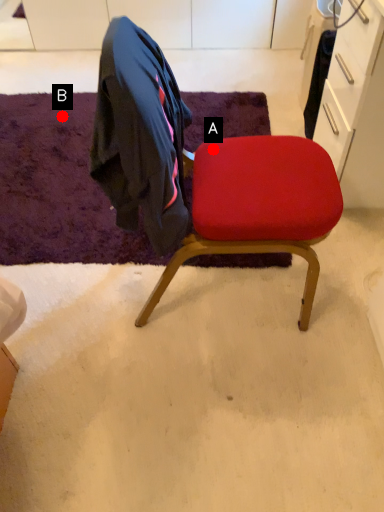
Question: Two points are circled on the image, labeled by A and B beside each circle. Which point is closer to the camera taking this photo?

Choices:
 (A) A is closer
 (B) B is closer

Answer: (A)